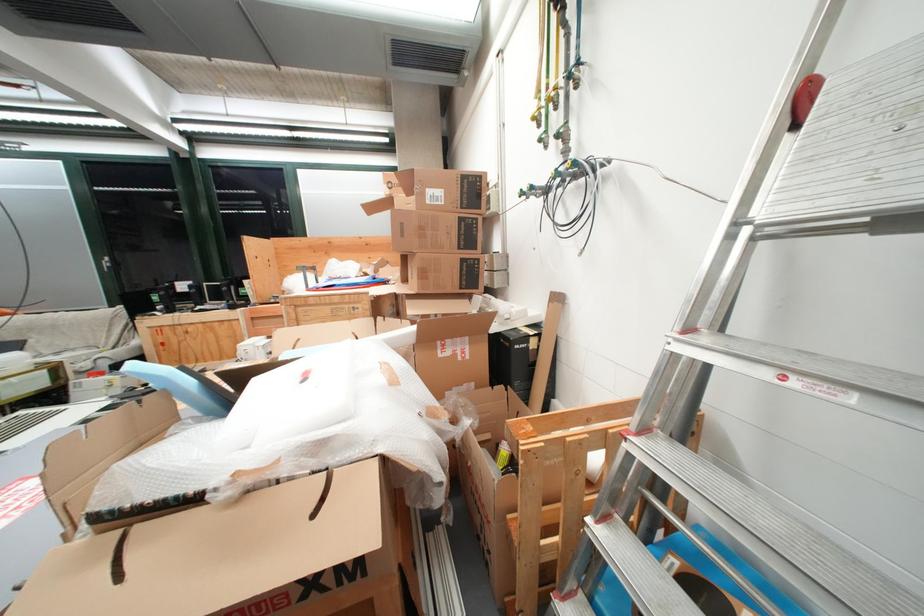
Where is `blue valve handle`? The height and width of the screenshot is (616, 924). blue valve handle is located at coordinates (184, 387).